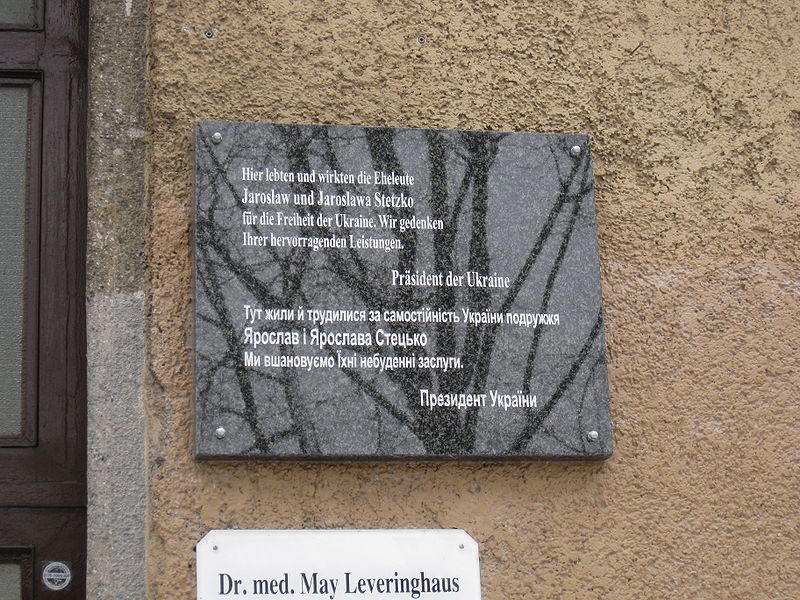
Find the location of a particular element. brown stucco wall is located at coordinates (729, 426).